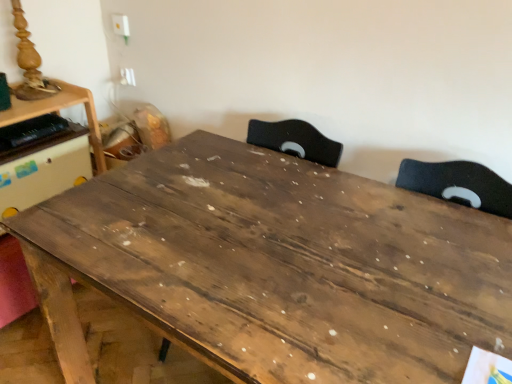
Question: Which direction should I rotate to look at wooden table at center, arranged as the first table when viewed from the right, — up or down?

Choices:
 (A) down
 (B) up

Answer: (A)

Question: Does wooden table at center, acting as the second table starting from the left, have a larger size compared to wooden table at left, the first table in the left-to-right sequence?

Choices:
 (A) no
 (B) yes

Answer: (B)

Question: Does wooden table at center, acting as the second table starting from the left, have a greater width compared to wooden table at left, the first table in the left-to-right sequence?

Choices:
 (A) no
 (B) yes

Answer: (B)

Question: Does wooden table at center, arranged as the first table when viewed from the right, lie behind wooden table at left, the first table in the left-to-right sequence?

Choices:
 (A) yes
 (B) no

Answer: (B)

Question: Is wooden table at center, arranged as the first table when viewed from the right, outside of wooden table at left, the first table in the left-to-right sequence?

Choices:
 (A) yes
 (B) no

Answer: (A)

Question: From the image's perspective, is wooden table at center, arranged as the first table when viewed from the right, above wooden table at left, the second table positioned from the right?

Choices:
 (A) no
 (B) yes

Answer: (A)

Question: Is wooden table at center, acting as the second table starting from the left, touching wooden table at left, the first table in the left-to-right sequence?

Choices:
 (A) yes
 (B) no

Answer: (B)

Question: Does wooden table at left, the second table positioned from the right, have a greater height compared to wooden table at center, arranged as the first table when viewed from the right?

Choices:
 (A) no
 (B) yes

Answer: (A)

Question: Is wooden table at left, the second table positioned from the right, smaller than wooden table at center, acting as the second table starting from the left?

Choices:
 (A) yes
 (B) no

Answer: (A)

Question: Does wooden table at left, the second table positioned from the right, appear on the left side of wooden table at center, acting as the second table starting from the left?

Choices:
 (A) yes
 (B) no

Answer: (A)

Question: Is wooden table at left, the first table in the left-to-right sequence, beside wooden table at center, acting as the second table starting from the left?

Choices:
 (A) yes
 (B) no

Answer: (B)

Question: Is wooden table at center, acting as the second table starting from the left, a part of wooden table at left, the second table positioned from the right?

Choices:
 (A) no
 (B) yes

Answer: (A)

Question: Is the position of wooden table at left, the first table in the left-to-right sequence, more distant than that of wooden table at center, arranged as the first table when viewed from the right?

Choices:
 (A) no
 (B) yes

Answer: (B)

Question: In terms of height, does wooden table at center, arranged as the first table when viewed from the right, look taller or shorter compared to wooden table at left, the first table in the left-to-right sequence?

Choices:
 (A) short
 (B) tall

Answer: (B)